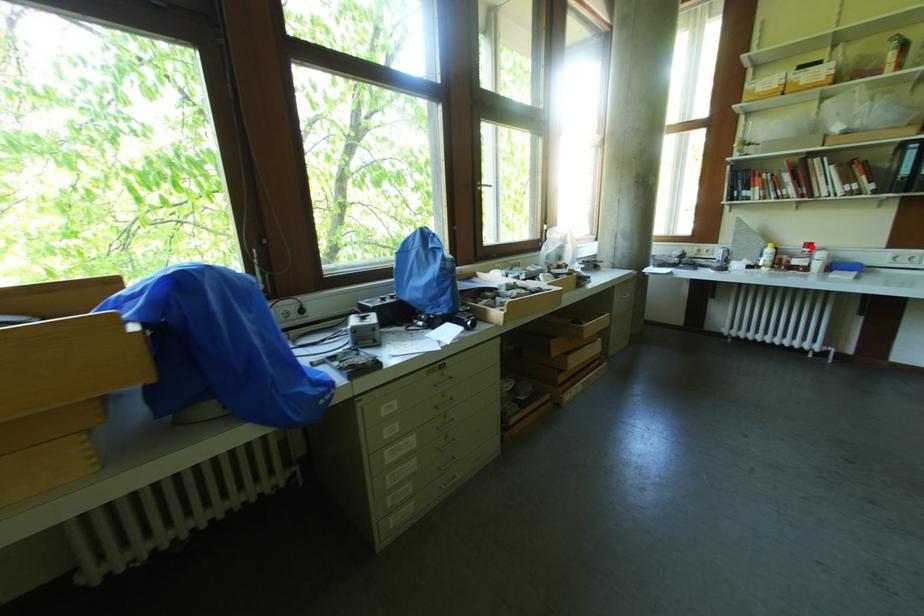
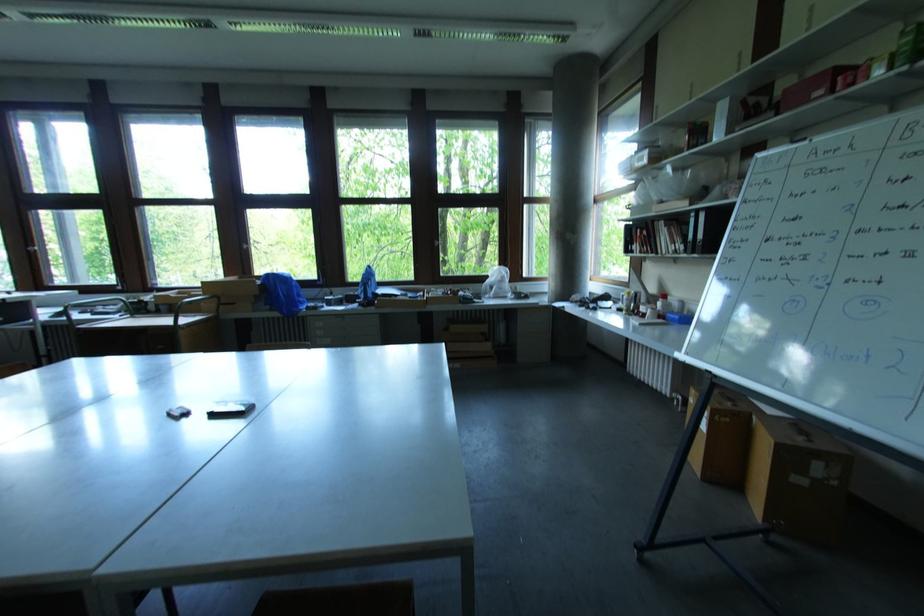
In the second image, find the point that corresponds to the highlighted location in the first image.

(667, 298)